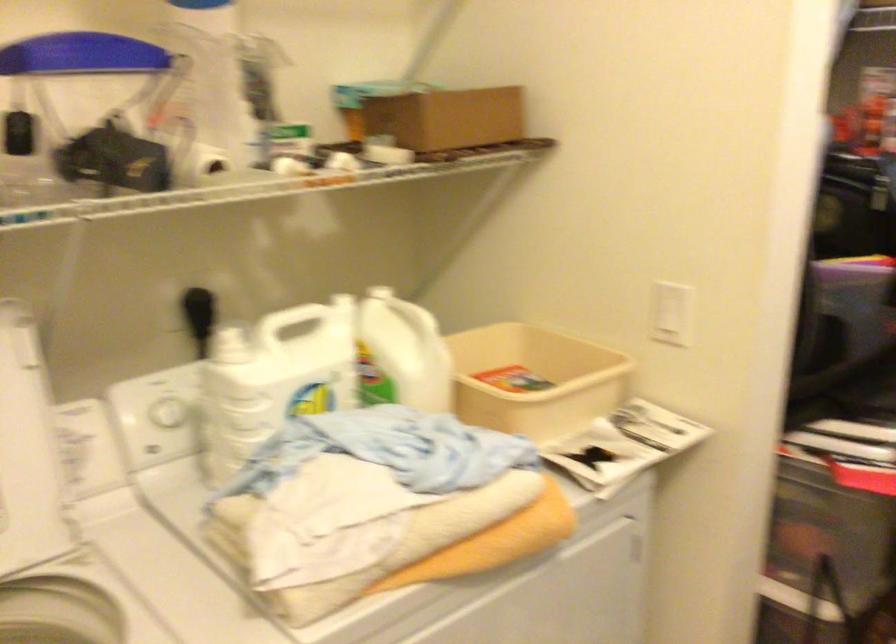
Locate an element on the screen. This screenshot has width=896, height=644. black brush handle is located at coordinates (197, 303).